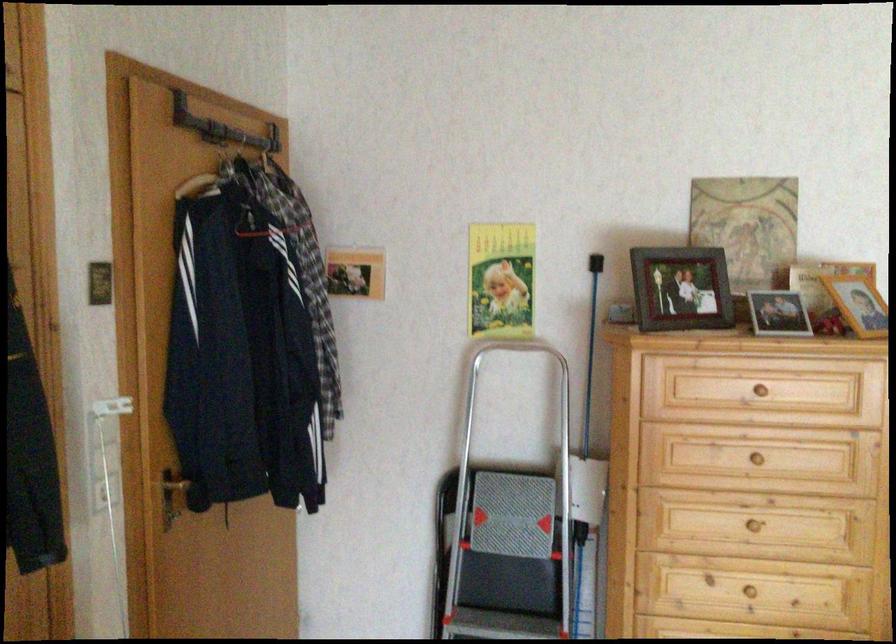
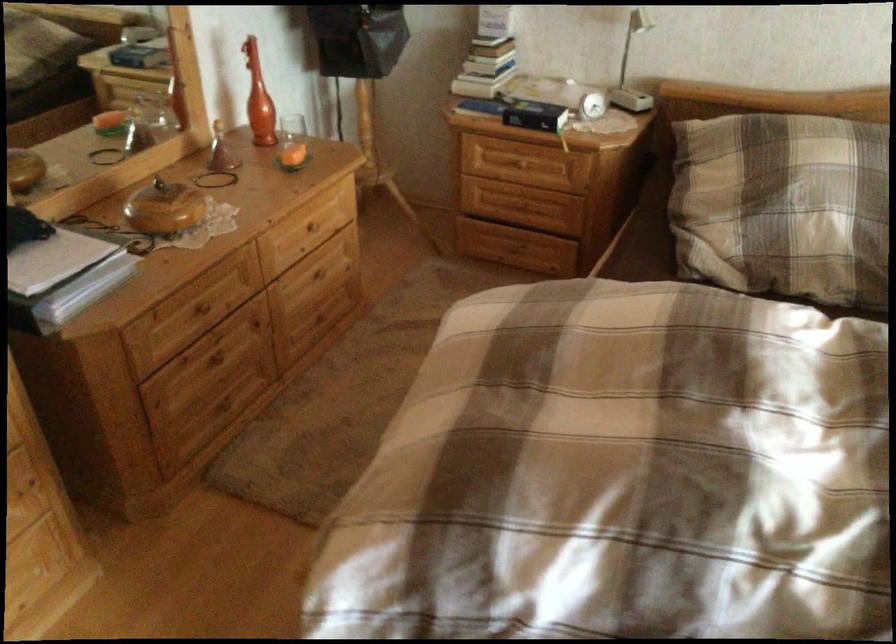
The first image is from the beginning of the video and the second image is from the end. How did the camera likely rotate when shooting the video?

The camera's rotation is toward right-down.